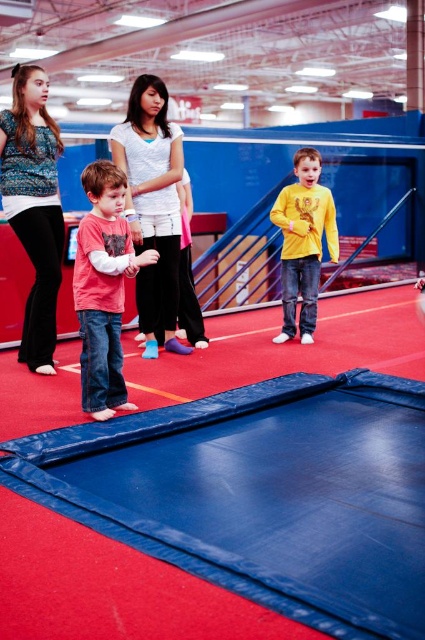
You are a photographer standing in the trampoline park and want to take a photo of the pink cotton shirt at left and the yellow matte shirt at center. Which of the two shirts is positioned lower in the image?

The pink cotton shirt at left is positioned lower because it is located below the yellow matte shirt at center.

You are standing at the entrance of the trampoline park and see the pink cotton shirt at left and the yellow matte shirt at center. Which shirt is nearer to you?

The pink cotton shirt at left is closer to the viewer than the yellow matte shirt at center.